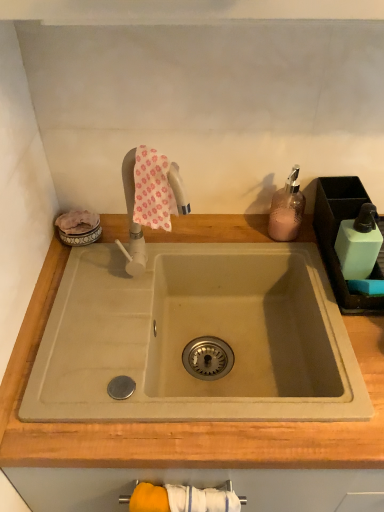
Question: From a real-world perspective, is pink textured soap dispenser at upper right over beige wood countertop at center?

Choices:
 (A) no
 (B) yes

Answer: (B)

Question: Is pink textured soap dispenser at upper right located outside beige wood countertop at center?

Choices:
 (A) no
 (B) yes

Answer: (B)

Question: Does pink textured soap dispenser at upper right appear on the right side of beige wood countertop at center?

Choices:
 (A) no
 (B) yes

Answer: (B)

Question: From the image's perspective, is pink textured soap dispenser at upper right on top of beige wood countertop at center?

Choices:
 (A) yes
 (B) no

Answer: (A)

Question: Is pink textured soap dispenser at upper right turned away from beige wood countertop at center?

Choices:
 (A) yes
 (B) no

Answer: (B)

Question: Is pink textured soap dispenser at upper right not close to beige wood countertop at center?

Choices:
 (A) yes
 (B) no

Answer: (B)

Question: Is light green plastic soap dispenser at right positioned behind pink floral fabric at upper center?

Choices:
 (A) no
 (B) yes

Answer: (B)

Question: Can you confirm if light green plastic soap dispenser at right is bigger than pink floral fabric at upper center?

Choices:
 (A) yes
 (B) no

Answer: (A)

Question: Considering the relative positions of light green plastic soap dispenser at right and pink floral fabric at upper center in the image provided, is light green plastic soap dispenser at right in front of pink floral fabric at upper center?

Choices:
 (A) no
 (B) yes

Answer: (A)

Question: Considering the relative positions of light green plastic soap dispenser at right and pink floral fabric at upper center in the image provided, is light green plastic soap dispenser at right to the left of pink floral fabric at upper center from the viewer's perspective?

Choices:
 (A) no
 (B) yes

Answer: (A)

Question: Does light green plastic soap dispenser at right appear on the right side of pink floral fabric at upper center?

Choices:
 (A) no
 (B) yes

Answer: (B)

Question: Can we say light green plastic soap dispenser at right lies outside pink floral fabric at upper center?

Choices:
 (A) no
 (B) yes

Answer: (B)

Question: From the image's perspective, does beige wood countertop at center appear higher than pink floral fabric at upper center?

Choices:
 (A) yes
 (B) no

Answer: (B)